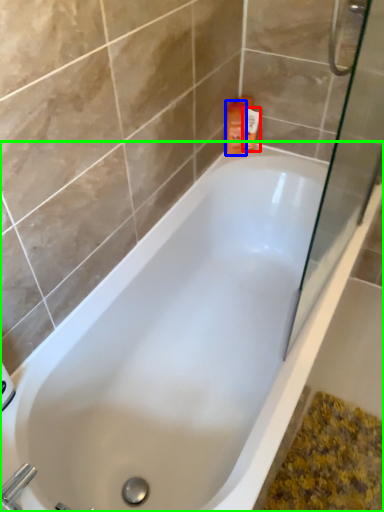
Question: Estimate the real-world distances between objects in this image. Which object is closer to toiletry (highlighted by a red box), cleaning product (highlighted by a blue box) or bathtub (highlighted by a green box)?

Choices:
 (A) cleaning product
 (B) bathtub

Answer: (A)